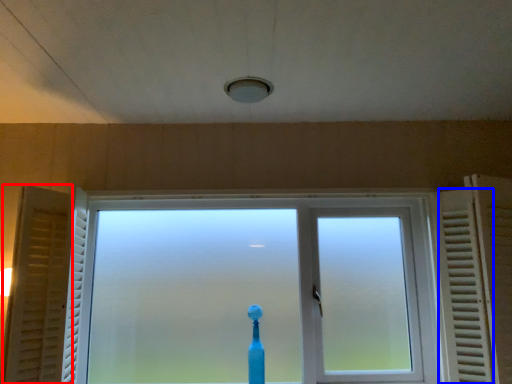
Question: Which of the following is the closest to the observer, curtain (highlighted by a red box) or radiator (highlighted by a blue box)?

Choices:
 (A) curtain
 (B) radiator

Answer: (B)